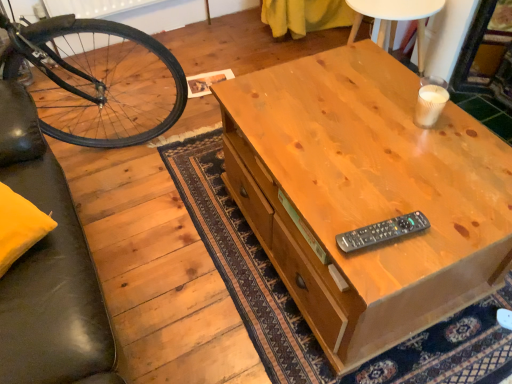
Question: Are light brown wood desk at center and white paper cup at upper right located far from each other?

Choices:
 (A) yes
 (B) no

Answer: (B)

Question: Is light brown wood desk at center to the left of white paper cup at upper right from the viewer's perspective?

Choices:
 (A) no
 (B) yes

Answer: (B)

Question: Is light brown wood desk at center positioned beyond the bounds of white paper cup at upper right?

Choices:
 (A) yes
 (B) no

Answer: (A)

Question: Is light brown wood desk at center oriented towards white paper cup at upper right?

Choices:
 (A) no
 (B) yes

Answer: (A)

Question: Is the position of light brown wood desk at center less distant than that of white paper cup at upper right?

Choices:
 (A) yes
 (B) no

Answer: (A)

Question: Is light brown wood desk at center wider or thinner than black plastic remote at center?

Choices:
 (A) thin
 (B) wide

Answer: (B)

Question: Based on their sizes in the image, would you say light brown wood desk at center is bigger or smaller than black plastic remote at center?

Choices:
 (A) small
 (B) big

Answer: (B)

Question: Considering the positions of point (334, 345) and point (350, 251), is point (334, 345) closer or farther from the camera than point (350, 251)?

Choices:
 (A) farther
 (B) closer

Answer: (A)

Question: Is light brown wood desk at center inside the boundaries of black plastic remote at center, or outside?

Choices:
 (A) outside
 (B) inside

Answer: (A)

Question: Considering the relative positions of white paper cup at upper right and light brown wood desk at center in the image provided, is white paper cup at upper right to the left or to the right of light brown wood desk at center?

Choices:
 (A) left
 (B) right

Answer: (B)

Question: Is white paper cup at upper right in front of or behind light brown wood desk at center in the image?

Choices:
 (A) front
 (B) behind

Answer: (B)

Question: Choose the correct answer: Is white paper cup at upper right inside light brown wood desk at center or outside it?

Choices:
 (A) inside
 (B) outside

Answer: (B)

Question: Looking at their shapes, would you say white paper cup at upper right is wider or thinner than light brown wood desk at center?

Choices:
 (A) wide
 (B) thin

Answer: (B)

Question: Visually, is black plastic remote at center positioned to the left or to the right of light brown wood desk at center?

Choices:
 (A) left
 (B) right

Answer: (A)

Question: From a real-world perspective, relative to light brown wood desk at center, is black plastic remote at center vertically above or below?

Choices:
 (A) below
 (B) above

Answer: (B)